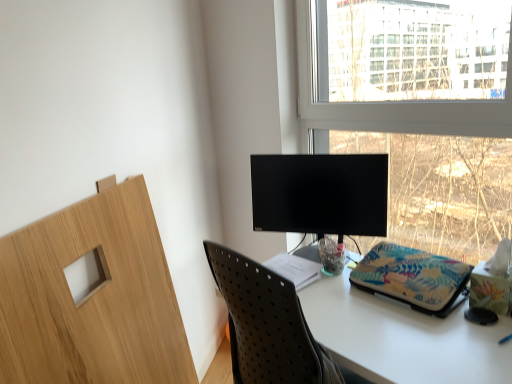
At what (x,y) coordinates should I click in order to perform the action: click on free point above white matte table at center (from a real-world perspective). Please return your answer as a coordinate pair (x, y). The height and width of the screenshot is (384, 512). Looking at the image, I should click on (374, 310).